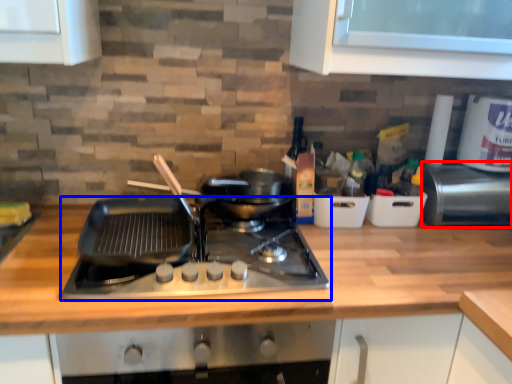
Question: Which object is further to the camera taking this photo, appliance (highlighted by a red box) or gas stove (highlighted by a blue box)?

Choices:
 (A) appliance
 (B) gas stove

Answer: (A)